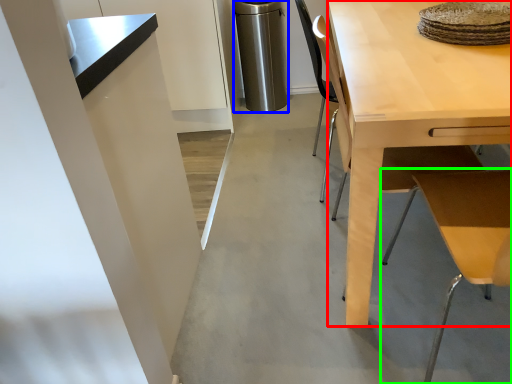
Question: Which object is positioned closest to desk (highlighted by a red box)? Select from appliance (highlighted by a blue box) and table (highlighted by a green box).

Choices:
 (A) appliance
 (B) table

Answer: (B)